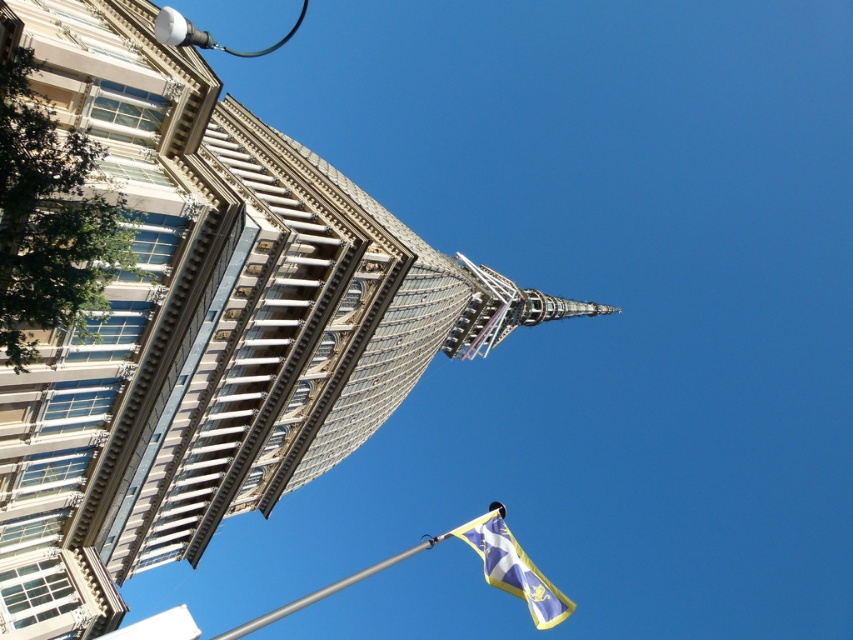
Question: Which point is closer to the camera taking this photo?

Choices:
 (A) (157, 28)
 (B) (486, 516)
 (C) (207, 400)
 (D) (503, 506)

Answer: (A)

Question: Is blue and yellow fabric flag at lower center below white glossy streetlight at upper left?

Choices:
 (A) no
 (B) yes

Answer: (B)

Question: Does glassy gray dome at upper center have a lesser width compared to white glossy streetlight at upper left?

Choices:
 (A) no
 (B) yes

Answer: (A)

Question: Which point is closer to the camera taking this photo?

Choices:
 (A) (228, 150)
 (B) (189, 38)
 (C) (541, 580)

Answer: (B)

Question: Which is farther from the white glossy streetlight at upper left?

Choices:
 (A) silver metallic flag pole at lower center
 (B) glassy gray dome at upper center
 (C) blue and yellow fabric flag at lower center

Answer: (A)

Question: Is silver metallic flag pole at lower center to the left of white glossy streetlight at upper left from the viewer's perspective?

Choices:
 (A) yes
 (B) no

Answer: (B)